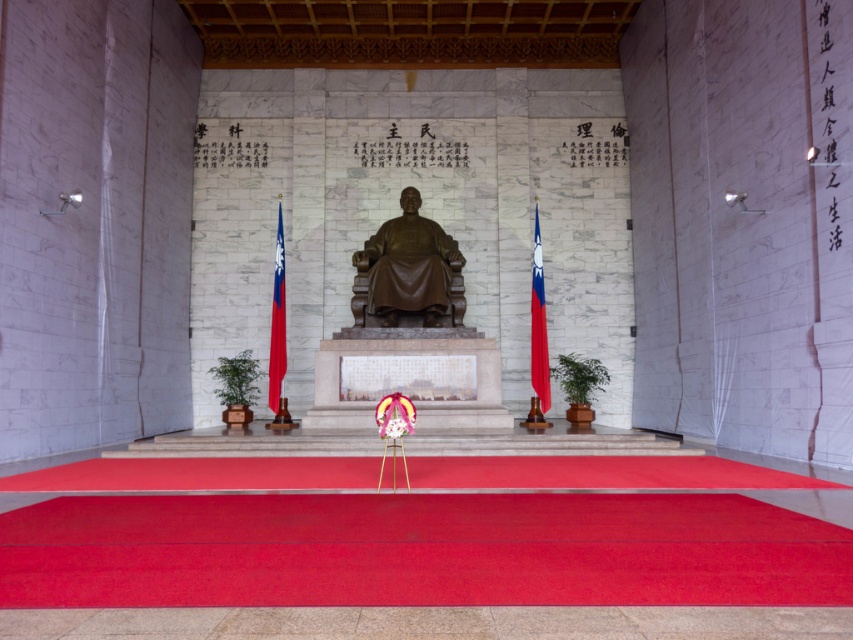
Question: Does bronze statue at center have a lesser width compared to red fabric flag at right?

Choices:
 (A) no
 (B) yes

Answer: (A)

Question: Which of the following is the farthest from the observer?

Choices:
 (A) bronze statue at center
 (B) red fabric flag at right

Answer: (A)

Question: Can you confirm if red fabric flag at center is positioned below red fabric flag at right?

Choices:
 (A) no
 (B) yes

Answer: (A)

Question: Which of the following is the closest to the observer?

Choices:
 (A) (281, 308)
 (B) (537, 276)

Answer: (A)

Question: Does bronze statue at center lie behind red fabric flag at right?

Choices:
 (A) yes
 (B) no

Answer: (A)

Question: Estimate the real-world distances between objects in this image. Which object is farther from the red fabric flag at center?

Choices:
 (A) bronze statue at center
 (B) red fabric flag at right

Answer: (B)